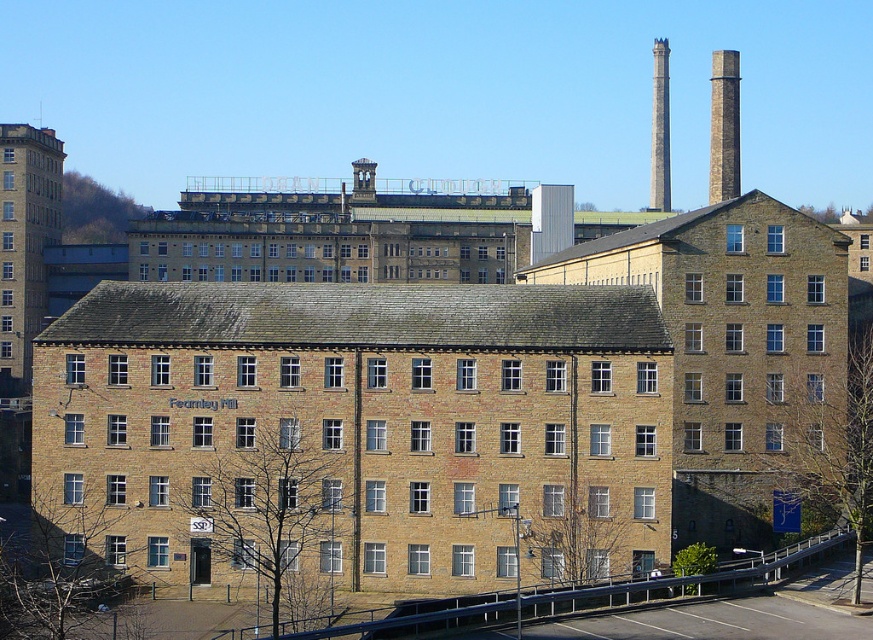
Does metallic rail at lower center appear on the left side of smooth gray chimney at upper right?

Correct, you'll find metallic rail at lower center to the left of smooth gray chimney at upper right.

Who is taller, metallic rail at lower center or smooth gray chimney at upper right?

Standing taller between the two is smooth gray chimney at upper right.

Locate an element on the screen. The image size is (873, 640). metallic rail at lower center is located at coordinates (679, 580).

Can you confirm if gray stone chimney at upper right is positioned to the right of smooth gray chimney at upper right?

Yes, gray stone chimney at upper right is to the right of smooth gray chimney at upper right.

What are the coordinates of `gray stone chimney at upper right` in the screenshot? It's located at (724, 125).

Is point (328, 621) closer to viewer compared to point (716, 106)?

Yes, point (328, 621) is in front of point (716, 106).

Between metallic rail at lower center and gray stone chimney at upper right, which one has less height?

Standing shorter between the two is metallic rail at lower center.

Identify the location of metallic rail at lower center. (679, 580).